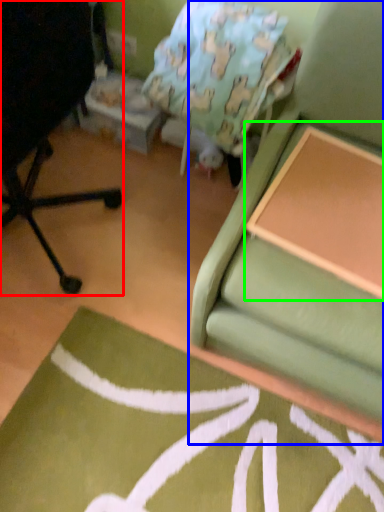
Question: Estimate the real-world distances between objects in this image. Which object is closer to chair (highlighted by a red box), studio couch (highlighted by a blue box) or table (highlighted by a green box)?

Choices:
 (A) studio couch
 (B) table

Answer: (A)